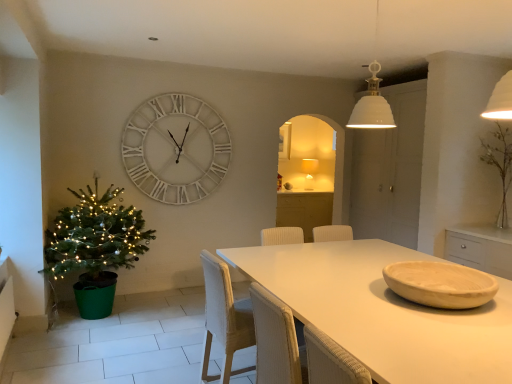
Question: From a real-world perspective, is woven white chair at center positioned over woven beige armchair at center based on gravity?

Choices:
 (A) yes
 (B) no

Answer: (B)

Question: Can you confirm if woven white chair at center is smaller than woven beige armchair at center?

Choices:
 (A) yes
 (B) no

Answer: (B)

Question: Is woven white chair at center to the right of woven beige armchair at center from the viewer's perspective?

Choices:
 (A) yes
 (B) no

Answer: (B)

Question: Considering the relative sizes of woven white chair at center and woven beige armchair at center in the image provided, is woven white chair at center taller than woven beige armchair at center?

Choices:
 (A) yes
 (B) no

Answer: (A)

Question: Is woven white chair at center looking in the opposite direction of woven beige armchair at center?

Choices:
 (A) yes
 (B) no

Answer: (B)

Question: From their relative heights in the image, would you say matte beige bowl at table center is taller or shorter than white matte table at center?

Choices:
 (A) short
 (B) tall

Answer: (A)

Question: In the image, is matte beige bowl at table center positioned in front of or behind white matte table at center?

Choices:
 (A) front
 (B) behind

Answer: (B)

Question: From a real-world perspective, is matte beige bowl at table center positioned above or below white matte table at center?

Choices:
 (A) above
 (B) below

Answer: (A)

Question: From the image's perspective, is matte beige bowl at table center positioned above or below white matte table at center?

Choices:
 (A) above
 (B) below

Answer: (A)

Question: Is matte white lampshade at center to the left or to the right of white matte table at center in the image?

Choices:
 (A) right
 (B) left

Answer: (A)

Question: In terms of height, does matte white lampshade at center look taller or shorter compared to white matte table at center?

Choices:
 (A) short
 (B) tall

Answer: (A)

Question: Considering their positions, is matte white lampshade at center located in front of or behind white matte table at center?

Choices:
 (A) behind
 (B) front

Answer: (A)

Question: Is matte white lampshade at center wider or thinner than white matte table at center?

Choices:
 (A) wide
 (B) thin

Answer: (B)

Question: Considering the positions of green plastic christmas tree at left and matte beige bowl at table center in the image, is green plastic christmas tree at left wider or thinner than matte beige bowl at table center?

Choices:
 (A) thin
 (B) wide

Answer: (B)

Question: In terms of height, does green plastic christmas tree at left look taller or shorter compared to matte beige bowl at table center?

Choices:
 (A) short
 (B) tall

Answer: (B)